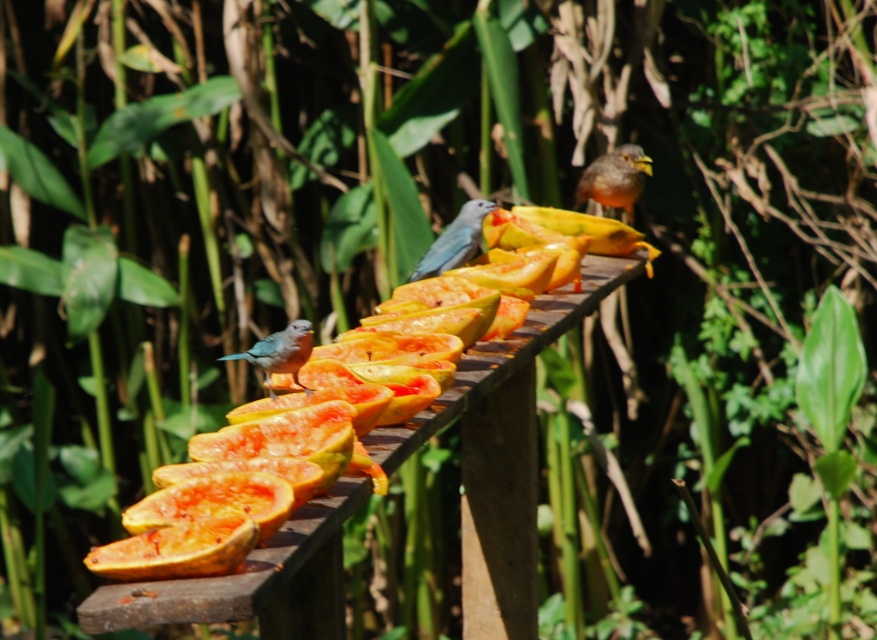
Question: Can you confirm if orange papaya at center is positioned below orange-brown feathers at upper right?

Choices:
 (A) yes
 (B) no

Answer: (A)

Question: Which object appears farthest from the camera in this image?

Choices:
 (A) orange-brown feathers at upper right
 (B) orange papaya at center
 (C) blue matte bird at center

Answer: (A)

Question: Which point is farther from the camera taking this photo?

Choices:
 (A) (586, 182)
 (B) (301, 362)
 (C) (447, 268)
 (D) (490, 365)

Answer: (A)

Question: Where is orange papaya at center located in relation to blue glossy bird at lower left in the image?

Choices:
 (A) right
 (B) left

Answer: (A)

Question: Which is farther from the orange-brown feathers at upper right?

Choices:
 (A) blue glossy bird at lower left
 (B) orange papaya at center

Answer: (A)

Question: Does orange papaya at center have a smaller size compared to blue matte bird at center?

Choices:
 (A) no
 (B) yes

Answer: (A)